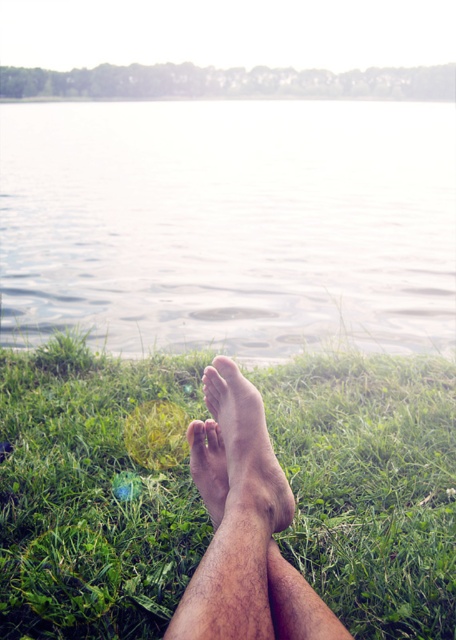
You are standing at the edge of the lake and want to place a small floating toy in the water. Which area between the clear water at center and the brown rough skin at lower center would you choose to ensure the toy floats freely without touching the edges?

The clear water at center is wider than the brown rough skin at lower center, so placing the toy in the clear water at center would allow it to float freely without touching the edges.

In the scene shown: You are a photographer trying to capture the reflection of the green grass at lower center in the lake. Based on the scene, where should you position your camera to ensure the reflection is clearly visible?

To capture the reflection of the green grass at lower center, position your camera at the same height as the water surface and aim towards the point where the grass meets the water. Since the green grass at lower center is located at coordinates approximately 0.775 on the x and 0.202 on the y axis, align your camera to focus on that specific area to ensure the reflection is clearly visible.